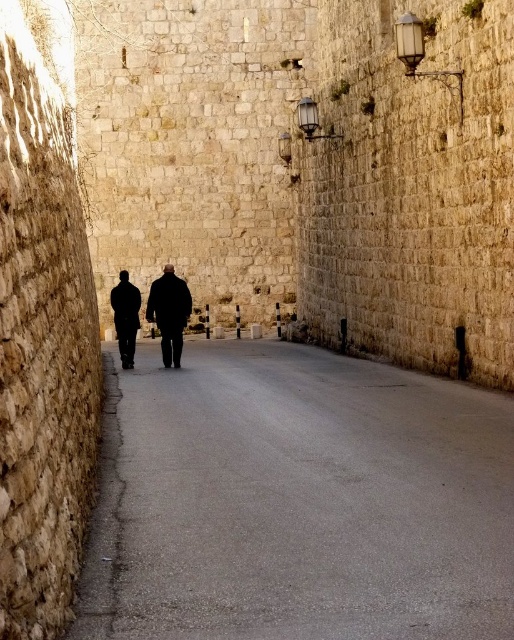
Is gray asphalt road at center shorter than dark matte coat at center?

Correct, gray asphalt road at center is not as tall as dark matte coat at center.

Between point (473, 436) and point (124, 307), which one is positioned in front?

Point (473, 436)

Which is behind, point (106, 550) or point (116, 305)?

The point (116, 305) is more distant.

You are a GUI agent. You are given a task and a screenshot of the screen. Output one action in this format:
    pyautogui.click(x=<x>, y=<y>)
    Task: Click on the gray asphalt road at center
    This screenshot has width=514, height=640.
    Given the screenshot: What is the action you would take?
    pyautogui.click(x=298, y=500)

Is point (277, 342) positioned in front of point (132, 296)?

No, (277, 342) is behind (132, 296).

Is gray asphalt road at center smaller than black matte clothing at center?

Correct, gray asphalt road at center occupies less space than black matte clothing at center.

The width and height of the screenshot is (514, 640). What do you see at coordinates (298, 500) in the screenshot?
I see `gray asphalt road at center` at bounding box center [298, 500].

The width and height of the screenshot is (514, 640). In order to click on gray asphalt road at center in this screenshot , I will do `click(298, 500)`.

Can you confirm if black matte clothing at center is positioned below dark matte coat at center?

Actually, black matte clothing at center is above dark matte coat at center.

Between point (120, 352) and point (130, 285), which one is positioned behind?

Positioned behind is point (120, 352).

Is point (159, 307) farther from camera compared to point (122, 289)?

No, it is not.

Where is `black matte clothing at center`? This screenshot has height=640, width=514. black matte clothing at center is located at coordinates (170, 312).